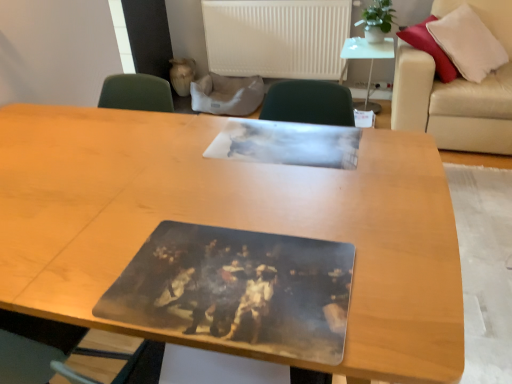
Question: From a real-world perspective, is white matte radiator at upper center beneath beige leather couch at right?

Choices:
 (A) yes
 (B) no

Answer: (B)

Question: Is white matte radiator at upper center taller than beige leather couch at right?

Choices:
 (A) yes
 (B) no

Answer: (B)

Question: Is white matte radiator at upper center at the left side of beige leather couch at right?

Choices:
 (A) no
 (B) yes

Answer: (B)

Question: From the image's perspective, is white matte radiator at upper center below beige leather couch at right?

Choices:
 (A) no
 (B) yes

Answer: (A)

Question: Is white matte radiator at upper center wider than beige leather couch at right?

Choices:
 (A) no
 (B) yes

Answer: (A)

Question: In terms of size, does beige leather couch at right appear bigger or smaller than white matte radiator at upper center?

Choices:
 (A) big
 (B) small

Answer: (A)

Question: From a real-world perspective, is beige leather couch at right above or below white matte radiator at upper center?

Choices:
 (A) above
 (B) below

Answer: (B)

Question: Considering the relative positions of beige leather couch at right and white matte radiator at upper center in the image provided, is beige leather couch at right to the left or to the right of white matte radiator at upper center?

Choices:
 (A) left
 (B) right

Answer: (B)

Question: From their relative heights in the image, would you say beige leather couch at right is taller or shorter than white matte radiator at upper center?

Choices:
 (A) short
 (B) tall

Answer: (B)

Question: Considering the positions of white matte radiator at upper center and beige leather couch at right in the image, is white matte radiator at upper center taller or shorter than beige leather couch at right?

Choices:
 (A) tall
 (B) short

Answer: (B)

Question: Considering the positions of white matte radiator at upper center and beige leather couch at right in the image, is white matte radiator at upper center wider or thinner than beige leather couch at right?

Choices:
 (A) wide
 (B) thin

Answer: (B)

Question: Considering their positions, is white matte radiator at upper center located in front of or behind beige leather couch at right?

Choices:
 (A) front
 (B) behind

Answer: (B)

Question: From a real-world perspective, is white matte radiator at upper center above or below beige leather couch at right?

Choices:
 (A) below
 (B) above

Answer: (B)

Question: From a real-world perspective, relative to wooden table at center, arranged as the 1th table when viewed from the front, is beige leather couch at right vertically above or below?

Choices:
 (A) below
 (B) above

Answer: (B)

Question: Considering the relative positions of beige leather couch at right and wooden table at center, arranged as the first table when viewed from the left, in the image provided, is beige leather couch at right to the left or to the right of wooden table at center, arranged as the first table when viewed from the left,?

Choices:
 (A) left
 (B) right

Answer: (B)